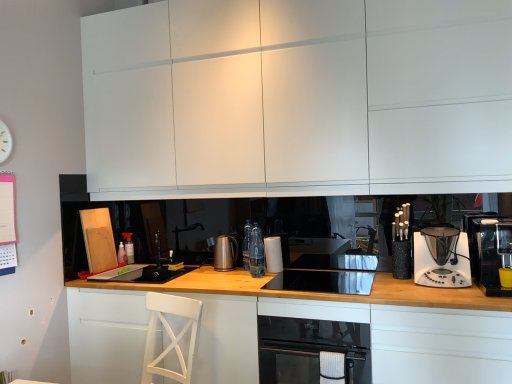
Question: Does black glass oven at lower center have a larger size compared to black glass cooktop at center?

Choices:
 (A) no
 (B) yes

Answer: (B)

Question: Is black glass oven at lower center not inside black glass cooktop at center?

Choices:
 (A) yes
 (B) no

Answer: (A)

Question: Does black glass oven at lower center appear on the left side of black glass cooktop at center?

Choices:
 (A) yes
 (B) no

Answer: (A)

Question: Can you confirm if black glass oven at lower center is thinner than black glass cooktop at center?

Choices:
 (A) no
 (B) yes

Answer: (A)

Question: From the image's perspective, is black glass oven at lower center on black glass cooktop at center?

Choices:
 (A) yes
 (B) no

Answer: (B)

Question: Would you say black glass oven at lower center contains black glass cooktop at center?

Choices:
 (A) yes
 (B) no

Answer: (B)

Question: Can you confirm if black glass oven at lower center is smaller than white matte cabinet at lower left, which appears as the second cabinetry when viewed from the top?

Choices:
 (A) no
 (B) yes

Answer: (A)

Question: Would you say black glass oven at lower center is outside white matte cabinet at lower left, placed as the 2th cabinetry when sorted from bottom to top?

Choices:
 (A) no
 (B) yes

Answer: (B)

Question: Is black glass oven at lower center directly adjacent to white matte cabinet at lower left, which appears as the second cabinetry when viewed from the top?

Choices:
 (A) no
 (B) yes

Answer: (A)

Question: Does black glass oven at lower center have a lesser height compared to white matte cabinet at lower left, placed as the 2th cabinetry when sorted from bottom to top?

Choices:
 (A) yes
 (B) no

Answer: (B)

Question: From the image's perspective, is black glass oven at lower center beneath white matte cabinet at lower left, placed as the 2th cabinetry when sorted from bottom to top?

Choices:
 (A) no
 (B) yes

Answer: (B)

Question: Is black glass oven at lower center further to camera compared to white matte cabinet at lower left, placed as the 2th cabinetry when sorted from bottom to top?

Choices:
 (A) yes
 (B) no

Answer: (A)

Question: From a real-world perspective, is white matte cabinet at lower left, which appears as the second cabinetry when viewed from the top, on top of white plastic clock at upper left?

Choices:
 (A) no
 (B) yes

Answer: (A)